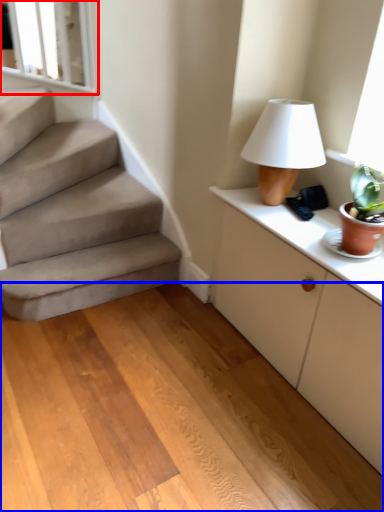
Question: Which point is further to the camera, window frame (highlighted by a red box) or concrete (highlighted by a blue box)?

Choices:
 (A) window frame
 (B) concrete

Answer: (A)